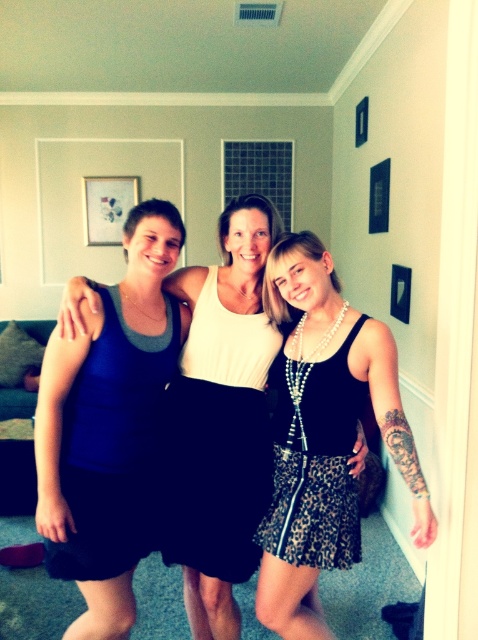
You are designing a clothing catalog and need to place the matte blue tank top at left and the leopard print skirt at center next to each other. Which item should you allocate more space to in the layout?

The matte blue tank top at left is bigger than the leopard print skirt at center, so you should allocate more space to the matte blue tank top at left in the layout.

You are a photographer setting up a shoot in the living room. You need to position a light source to the right of the leopard print skirt at center but still to the left of the matte blue tank top at left. Is this possible based on their positions?

The matte blue tank top at left is to the left of the leopard print skirt at center, so placing a light source to the right of the leopard print skirt at center but still to the left of the matte blue tank top at left is not possible because the leopard print skirt at center is already to the right of the matte blue tank top at left.

You are planning to hang a picture frame between the black satin dress at right and the matte blue tank top at left. Which side should you place it closer to if you want the frame to be at the same height as the taller object?

The black satin dress at right is much taller as matte blue tank top at left, so you should place the picture frame closer to the black satin dress at right to match its height.